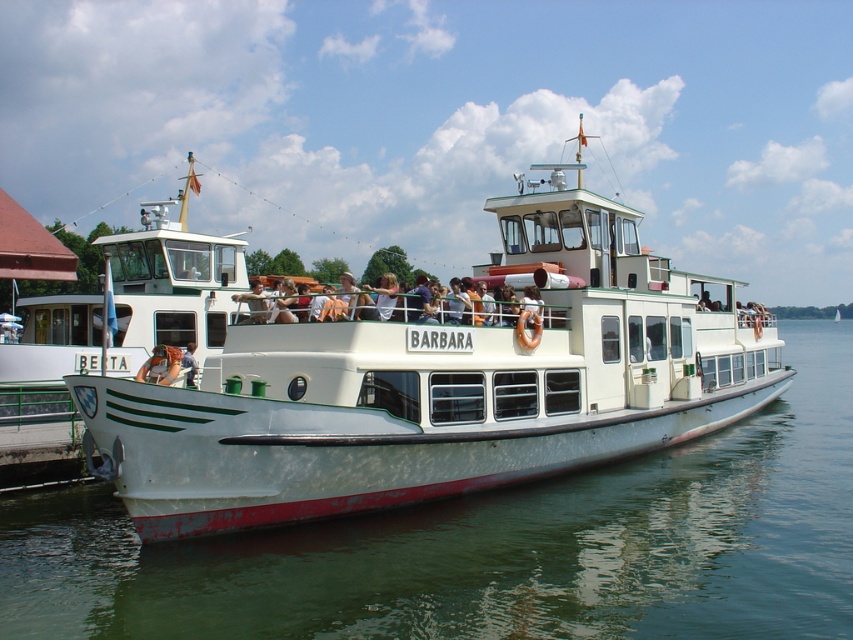
Question: From the image, what is the correct spatial relationship of white matte boat at center in relation to matte white shirt at center?

Choices:
 (A) left
 (B) right

Answer: (B)

Question: Which of the following is the farthest from the observer?

Choices:
 (A) (254, 275)
 (B) (633, 296)
 (C) (659, 524)

Answer: (A)

Question: Considering the real-world distances, which object is closest to the matte white shirt at center?

Choices:
 (A) white matte boat at center
 (B) white water at center

Answer: (A)

Question: Does white matte boat at center appear under matte white shirt at center?

Choices:
 (A) no
 (B) yes

Answer: (A)

Question: Considering the relative positions of white matte boat at center and matte white shirt at center in the image provided, where is white matte boat at center located with respect to matte white shirt at center?

Choices:
 (A) above
 (B) below

Answer: (A)

Question: Which object is positioned closest to the matte white shirt at center?

Choices:
 (A) white matte boat at center
 (B) white water at center

Answer: (A)